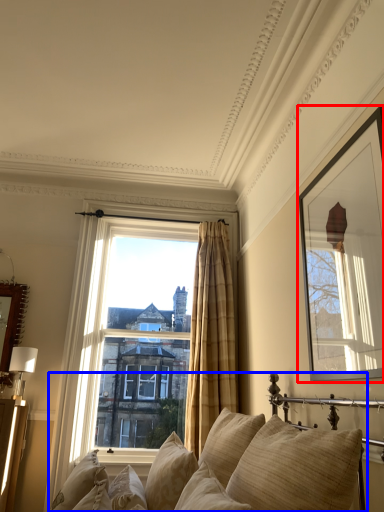
Question: Among these objects, which one is farthest to the camera, picture frame (highlighted by a red box) or studio couch (highlighted by a blue box)?

Choices:
 (A) picture frame
 (B) studio couch

Answer: (A)